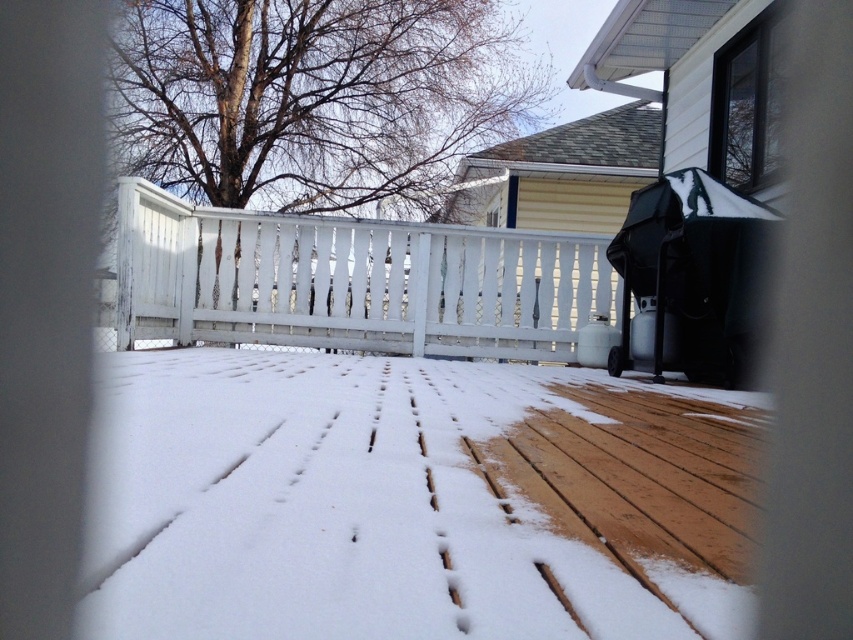
You are standing on the deck looking at two points marked in the scene. Which point is closer to you, point [477,609] or point [370,294]?

Point [477,609] is closer to the camera than point [370,294].

You are standing on the deck in the snowy scene and want to place a small potted plant exactly at the point marked by coordinates point (410, 500). Based on the description, where on the deck should you place the potted plant?

The point (410, 500) corresponds to the white wood deck at center, so you should place the potted plant at the center of the white wood deck.